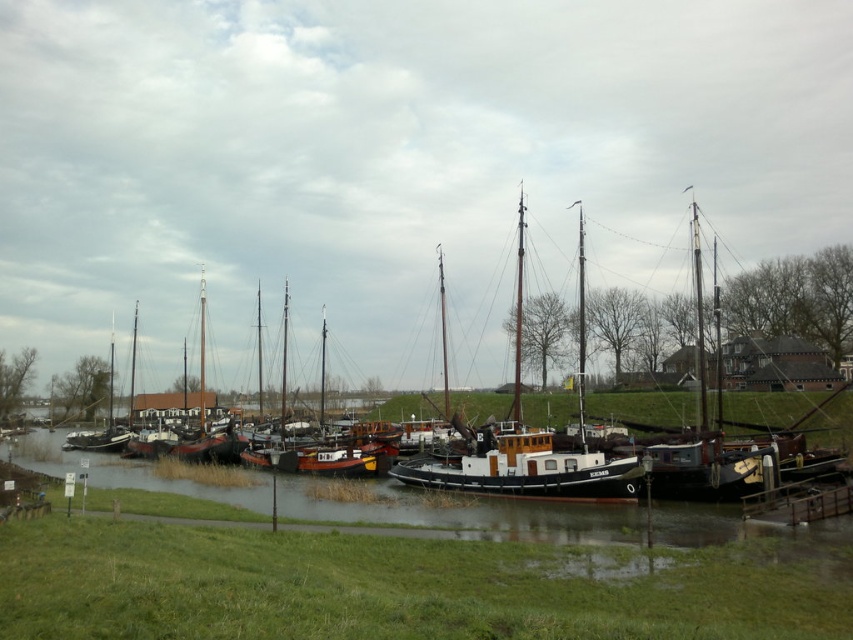
Question: Can you confirm if wooden boat at center is positioned to the left of wooden dock at lower right?

Choices:
 (A) no
 (B) yes

Answer: (B)

Question: Which of the following is the closest to the observer?

Choices:
 (A) (811, 516)
 (B) (256, 451)
 (C) (244, 484)

Answer: (A)

Question: Does wooden sailboat at center appear on the right side of wooden dock at lower right?

Choices:
 (A) yes
 (B) no

Answer: (B)

Question: Which object appears farthest from the camera in this image?

Choices:
 (A) wooden sailboat at center
 (B) smooth water at center
 (C) wooden dock at lower right
 (D) wooden boat at center

Answer: (A)

Question: Is wooden sailboat at center positioned before wooden dock at lower right?

Choices:
 (A) yes
 (B) no

Answer: (B)

Question: Estimate the real-world distances between objects in this image. Which object is farther from the wooden dock at lower right?

Choices:
 (A) wooden sailboat at center
 (B) smooth water at center

Answer: (A)